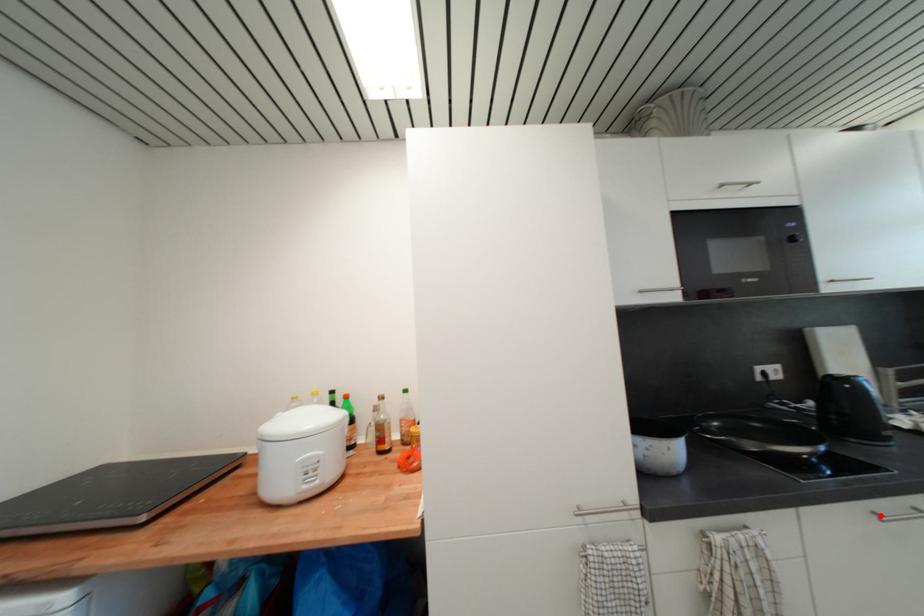
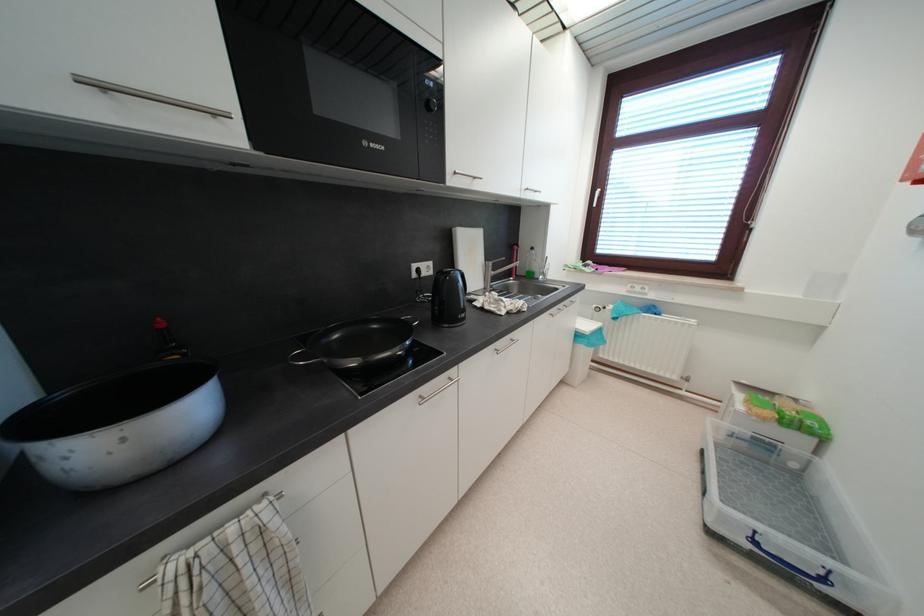
Question: I am providing you with two images of the same scene from different viewpoints. Image1 has a red point marked. In image2, the corresponding 3D location appears at what relative position? Reply with the corresponding letter.

Choices:
 (A) Closer
 (B) Farther

Answer: (B)